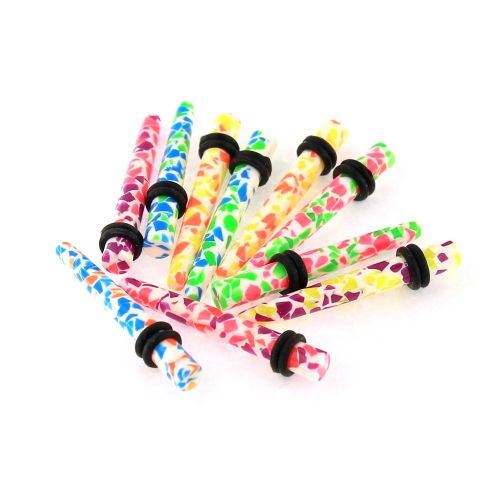
Locate an element on the screen. empty space below plug is located at coordinates (199, 432).